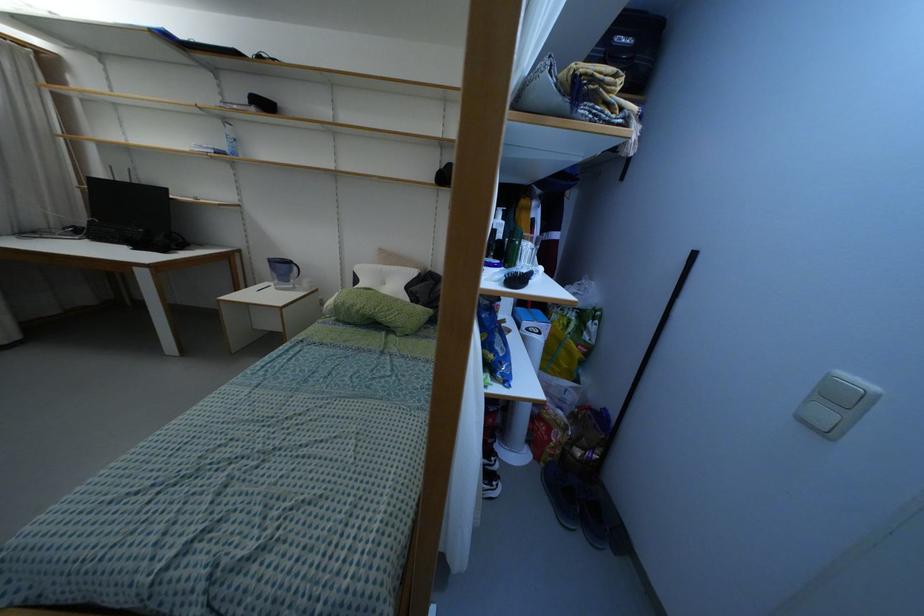
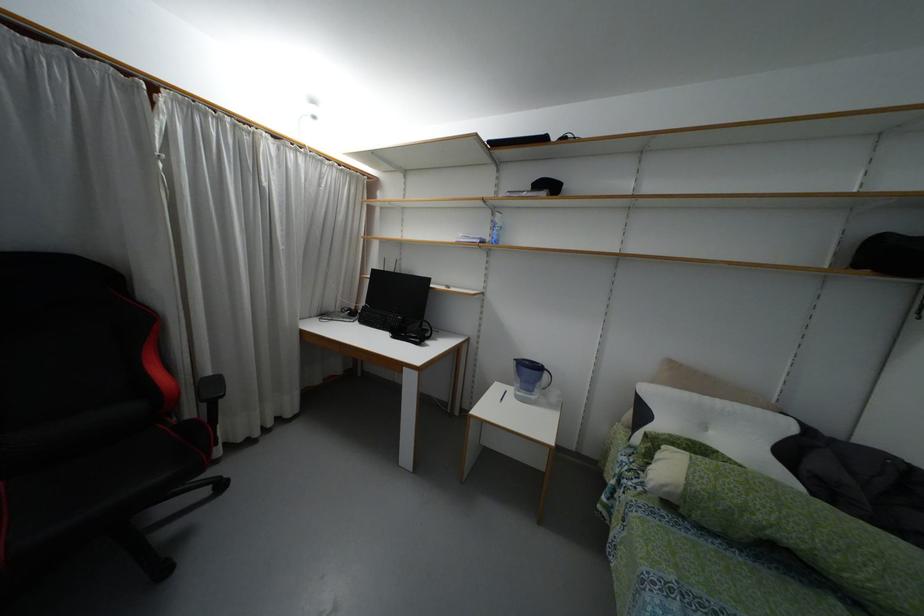
Locate, in the second image, the point that corresponds to (379,265) in the first image.

(695, 395)